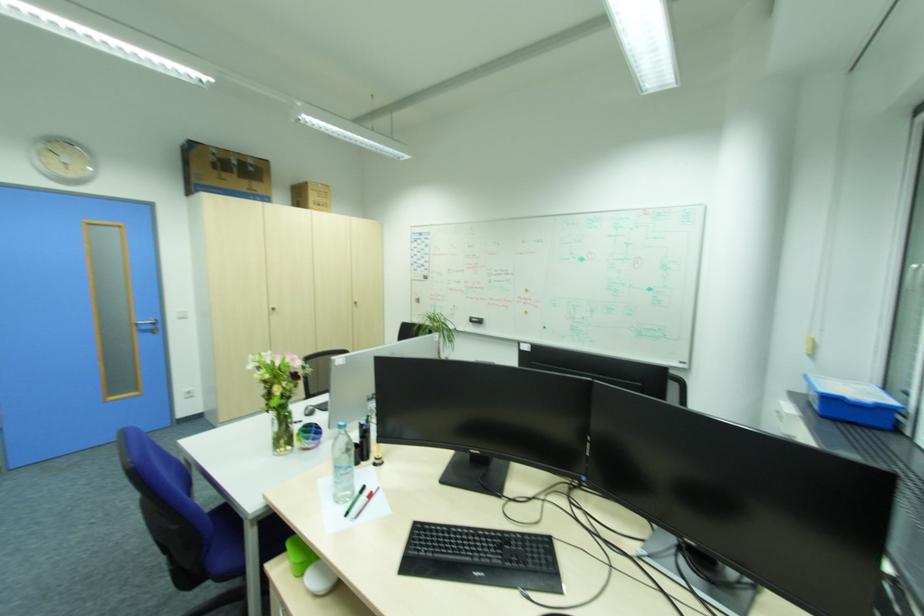
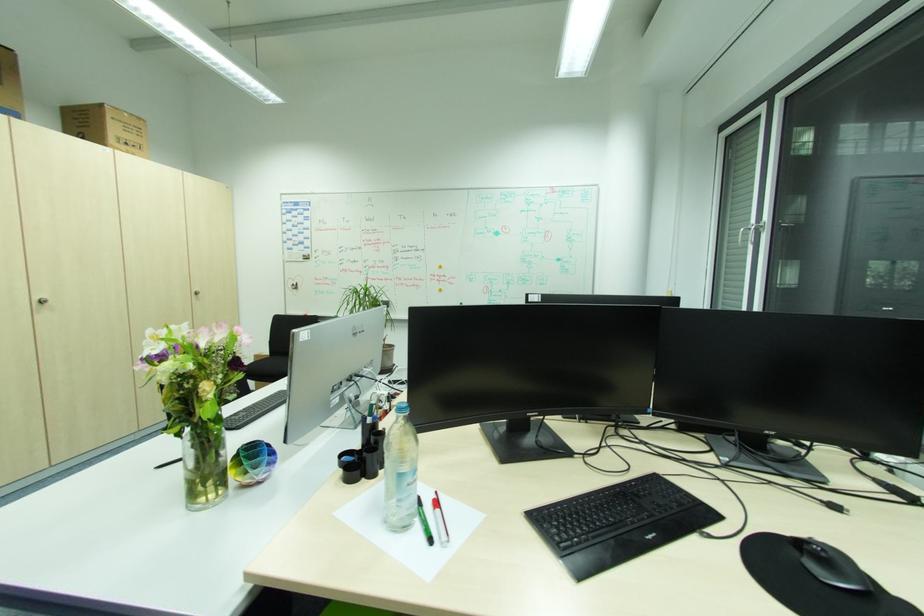
The point at (489, 573) is marked in the first image. Where is the corresponding point in the second image?

(660, 533)